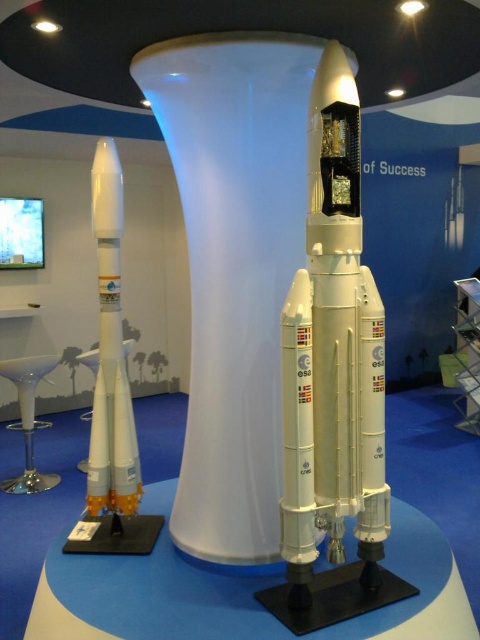
Is white matte rocket at center to the left of white matte rocket at left from the viewer's perspective?

In fact, white matte rocket at center is to the right of white matte rocket at left.

Where is `white matte rocket at center`? The height and width of the screenshot is (640, 480). white matte rocket at center is located at coordinates pyautogui.click(x=333, y=384).